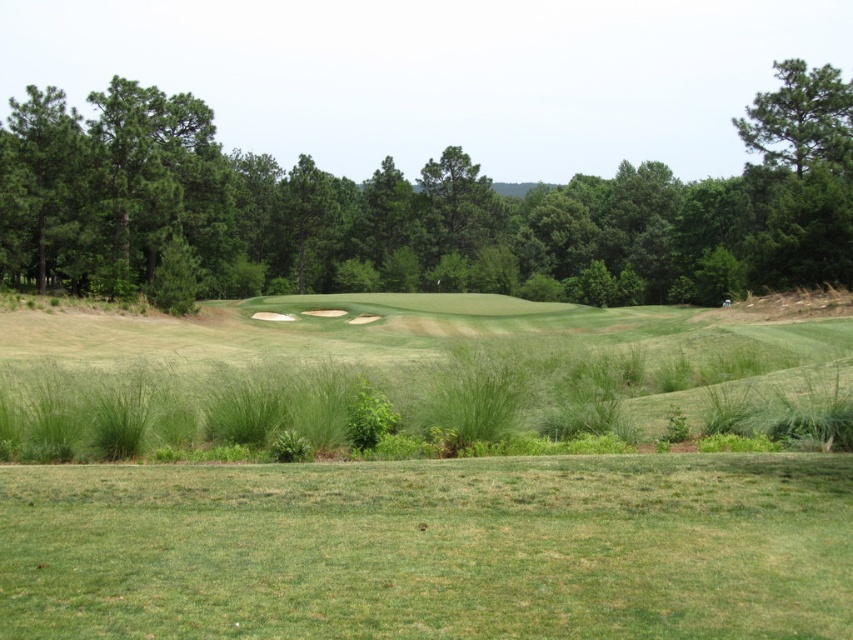
Which is in front, point (769, 467) or point (811, 124)?

Positioned in front is point (769, 467).

Is green grass at lower center wider than green textured tree at upper right?

In fact, green grass at lower center might be narrower than green textured tree at upper right.

Does point (196, 468) lie behind point (799, 88)?

That is False.

Locate an element on the screen. The width and height of the screenshot is (853, 640). green grass at lower center is located at coordinates (431, 548).

Does green grass at lower center have a lesser height compared to green leafy tree at upper center?

Yes, green grass at lower center is shorter than green leafy tree at upper center.

Is green grass at lower center smaller than green leafy tree at upper center?

Yes.

Consider the image. Who is more distant from viewer, (99, 474) or (676, 296)?

Point (676, 296)

At what (x,y) coordinates should I click in order to perform the action: click on green grass at lower center. Please return your answer as a coordinate pair (x, y). The height and width of the screenshot is (640, 853). Looking at the image, I should click on (431, 548).

Which is below, green leafy tree at upper center or green textured tree at upper right?

green leafy tree at upper center is below.

Which is behind, point (520, 260) or point (807, 112)?

The point (520, 260) is behind.

Measure the distance between green leafy tree at upper center and camera.

green leafy tree at upper center is 55.96 meters away from camera.

This screenshot has height=640, width=853. In order to click on green leafy tree at upper center in this screenshot , I will do `click(416, 209)`.